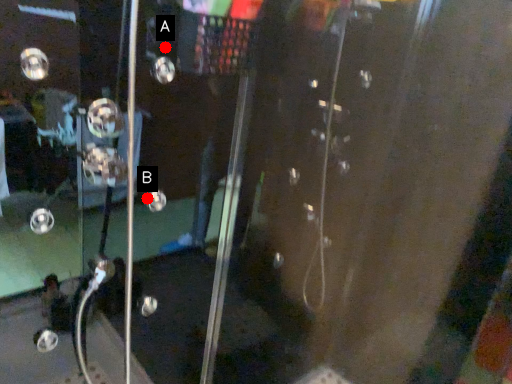
Question: Two points are circled on the image, labeled by A and B beside each circle. Which point is farther from the camera taking this photo?

Choices:
 (A) A is further
 (B) B is further

Answer: (B)